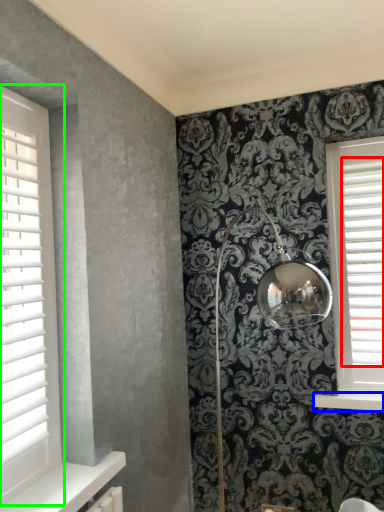
Question: Estimate the real-world distances between objects in this image. Which object is farther from blind (highlighted by a red box), window sill (highlighted by a blue box) or window (highlighted by a green box)?

Choices:
 (A) window sill
 (B) window

Answer: (B)